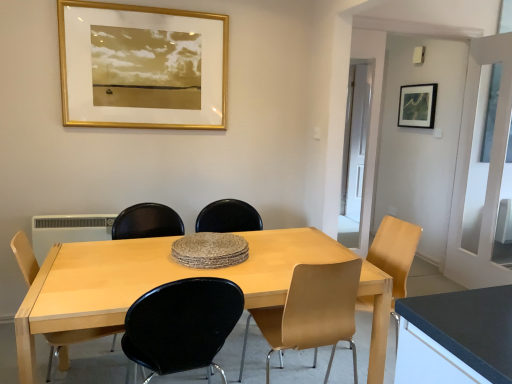
Question: Is matte yellow chair at right, the fourth chair positioned from the left, bigger than light wood table at center?

Choices:
 (A) yes
 (B) no

Answer: (B)

Question: Considering the relative sizes of matte yellow chair at right, the fourth chair positioned from the left, and light wood table at center in the image provided, is matte yellow chair at right, the fourth chair positioned from the left, wider than light wood table at center?

Choices:
 (A) no
 (B) yes

Answer: (A)

Question: Are matte yellow chair at right, the fourth chair positioned from the left, and light wood table at center far apart?

Choices:
 (A) no
 (B) yes

Answer: (A)

Question: Is matte yellow chair at right, the fourth chair positioned from the left, turned away from light wood table at center?

Choices:
 (A) yes
 (B) no

Answer: (B)

Question: Is matte yellow chair at right, the 1th chair in the right-to-left sequence, facing towards light wood table at center?

Choices:
 (A) no
 (B) yes

Answer: (B)

Question: Is matte yellow chair at right, the 1th chair in the right-to-left sequence, to the left of light wood table at center from the viewer's perspective?

Choices:
 (A) yes
 (B) no

Answer: (B)

Question: From the image's perspective, is matte black chair at center, which is the second armchair from right to left, below light wood table at center?

Choices:
 (A) yes
 (B) no

Answer: (B)

Question: Is the position of matte black chair at center, which appears as the first armchair when viewed from the left, less distant than that of light wood table at center?

Choices:
 (A) no
 (B) yes

Answer: (A)

Question: Is matte black chair at center, which appears as the first armchair when viewed from the left, not close to light wood table at center?

Choices:
 (A) yes
 (B) no

Answer: (B)

Question: Does matte black chair at center, which appears as the first armchair when viewed from the left, have a greater width compared to light wood table at center?

Choices:
 (A) no
 (B) yes

Answer: (A)

Question: From the image's perspective, is matte black chair at center, which appears as the first armchair when viewed from the left, over light wood table at center?

Choices:
 (A) no
 (B) yes

Answer: (B)

Question: Is matte black chair at center, which is the second armchair from right to left, behind light wood table at center?

Choices:
 (A) yes
 (B) no

Answer: (A)

Question: From the image's perspective, does light brown wood chair at lower left, which appears as the 1th chair when viewed from the left, appear lower than light brown wood chair at center, marked as the third chair in a left-to-right arrangement?

Choices:
 (A) no
 (B) yes

Answer: (A)